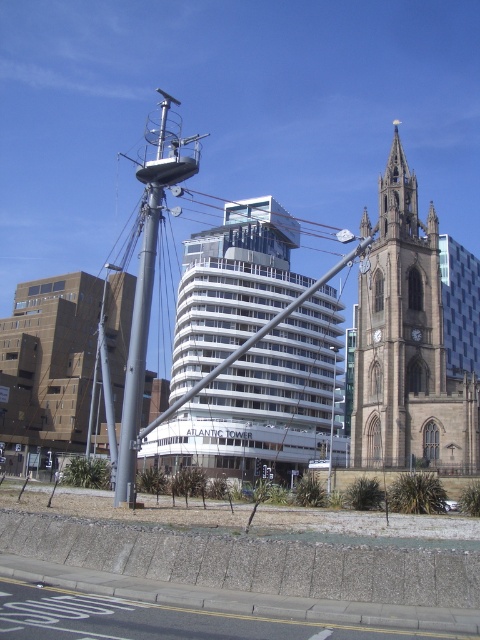
Based on the scene description, where is the brown stone clock tower at center located in terms of its 2D coordinates?

The brown stone clock tower at center is located at the 2D coordinates point (x=398, y=330).

You are a photographer standing at the base of the metallic mast structure in the urban scene. You want to take a photo that includes both the point at coordinates point [393,451] and point [79,419]. Which point will appear larger in your photo?

Point [393,451] will appear larger in the photo because it is closer to the camera than point [79,419].